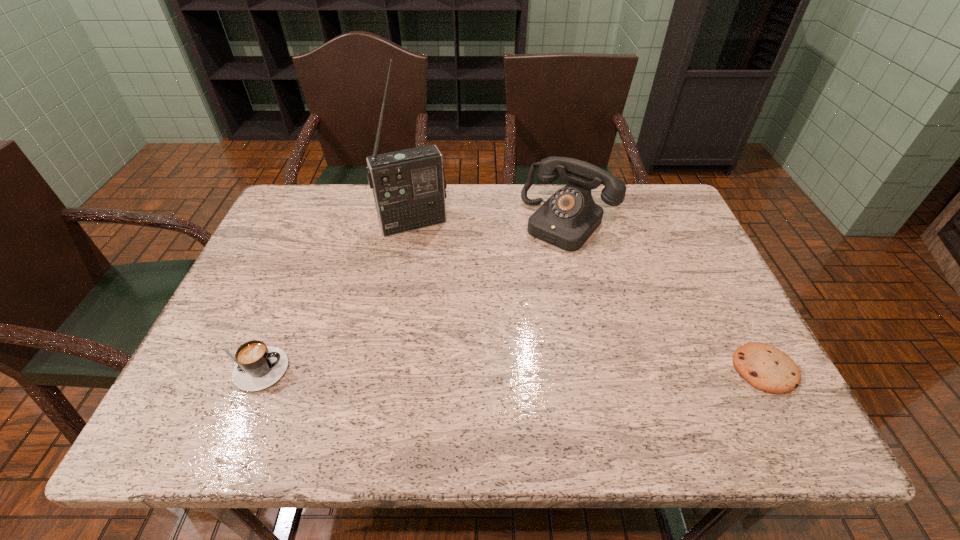
Where is `object at the left edge`? object at the left edge is located at coordinates point(258,366).

What are the coordinates of `object present at the right edge` in the screenshot? It's located at (766, 368).

Image resolution: width=960 pixels, height=540 pixels. In order to click on object at the near left corner in this screenshot , I will do `click(258, 366)`.

The image size is (960, 540). I want to click on object situated at the near right corner, so click(x=766, y=368).

At what (x,y) coordinates should I click in order to perform the action: click on free spot at the far edge of the desktop. Please return your answer as a coordinate pair (x, y). Looking at the image, I should click on (x=334, y=215).

Where is `free region at the near edge of the desktop`? free region at the near edge of the desktop is located at coordinates (427, 380).

Where is `vacant space at the left edge of the desktop`? vacant space at the left edge of the desktop is located at coordinates (288, 296).

Find the location of a particular element. blank area at the far right corner is located at coordinates (651, 200).

Where is `free space at the near right corner of the desktop`? free space at the near right corner of the desktop is located at coordinates (708, 364).

This screenshot has width=960, height=540. I want to click on free space that is in between the cookie and the third tallest object, so click(x=508, y=369).